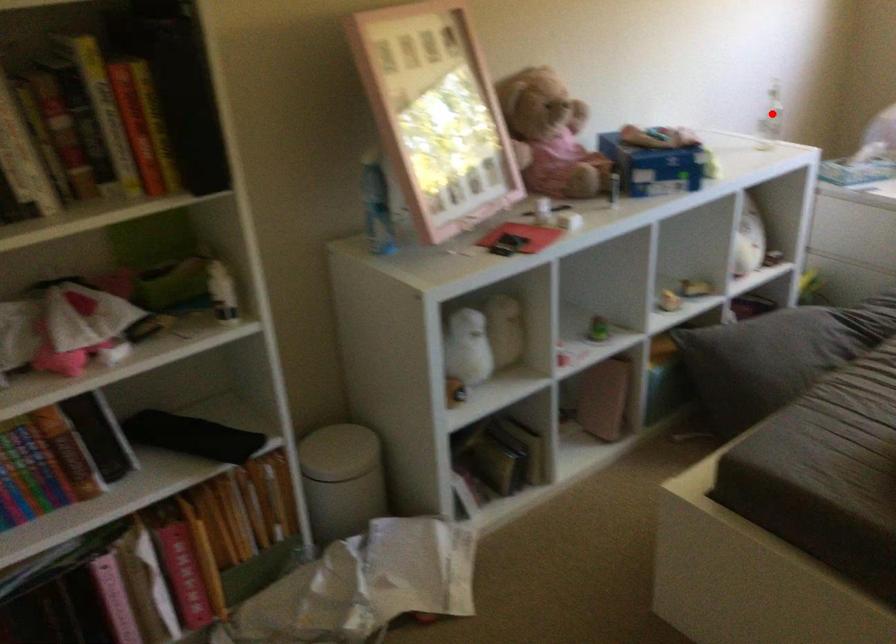
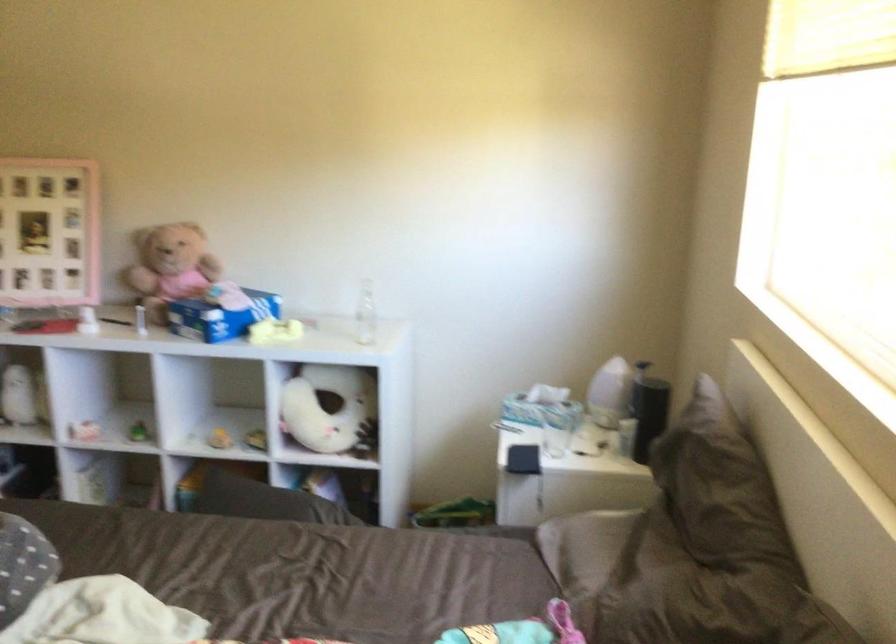
Question: I am providing you with two images of the same scene from different viewpoints. A red point is marked on the first image. At the location where the point appears in image 1, is it still visible in image 2?

Choices:
 (A) Yes
 (B) No

Answer: (B)